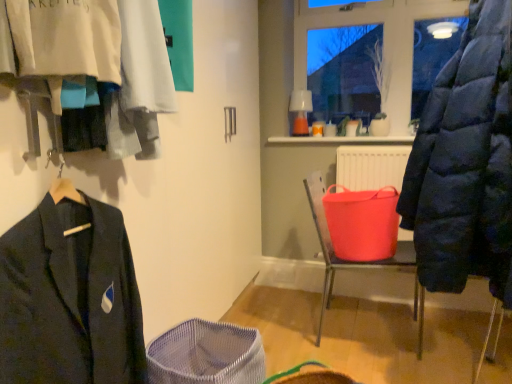
Question: From a real-world perspective, is rubberized plastic bucket at center physically below matte black jacket at left?

Choices:
 (A) no
 (B) yes

Answer: (B)

Question: From a real-world perspective, is rubberized plastic bucket at center over matte black jacket at left?

Choices:
 (A) no
 (B) yes

Answer: (A)

Question: Is rubberized plastic bucket at center not close to matte black jacket at left?

Choices:
 (A) yes
 (B) no

Answer: (A)

Question: Is rubberized plastic bucket at center next to matte black jacket at left?

Choices:
 (A) yes
 (B) no

Answer: (B)

Question: Can matte black jacket at left be found inside rubberized plastic bucket at center?

Choices:
 (A) no
 (B) yes

Answer: (A)

Question: Based on their sizes in the image, would you say transparent glass window at upper center is bigger or smaller than matte black jacket at left?

Choices:
 (A) small
 (B) big

Answer: (A)

Question: Do you think transparent glass window at upper center is within matte black jacket at left, or outside of it?

Choices:
 (A) inside
 (B) outside

Answer: (B)

Question: From the image's perspective, is transparent glass window at upper center above or below matte black jacket at left?

Choices:
 (A) above
 (B) below

Answer: (A)

Question: Does point (384, 21) appear closer or farther from the camera than point (103, 268)?

Choices:
 (A) farther
 (B) closer

Answer: (A)

Question: Is rubberized plastic bucket at center situated inside matte black jacket at left or outside?

Choices:
 (A) outside
 (B) inside

Answer: (A)

Question: Considering the positions of point [407, 241] and point [47, 291], is point [407, 241] closer or farther from the camera than point [47, 291]?

Choices:
 (A) closer
 (B) farther

Answer: (B)

Question: Considering their positions, is rubberized plastic bucket at center located in front of or behind matte black jacket at left?

Choices:
 (A) front
 (B) behind

Answer: (B)

Question: Would you say rubberized plastic bucket at center is to the left or to the right of matte black jacket at left in the picture?

Choices:
 (A) left
 (B) right

Answer: (B)

Question: Considering their positions, is rubberized plastic bucket at center located in front of or behind mesh fabric basket at lower center?

Choices:
 (A) behind
 (B) front

Answer: (A)

Question: Considering the positions of rubberized plastic bucket at center and mesh fabric basket at lower center in the image, is rubberized plastic bucket at center bigger or smaller than mesh fabric basket at lower center?

Choices:
 (A) small
 (B) big

Answer: (B)